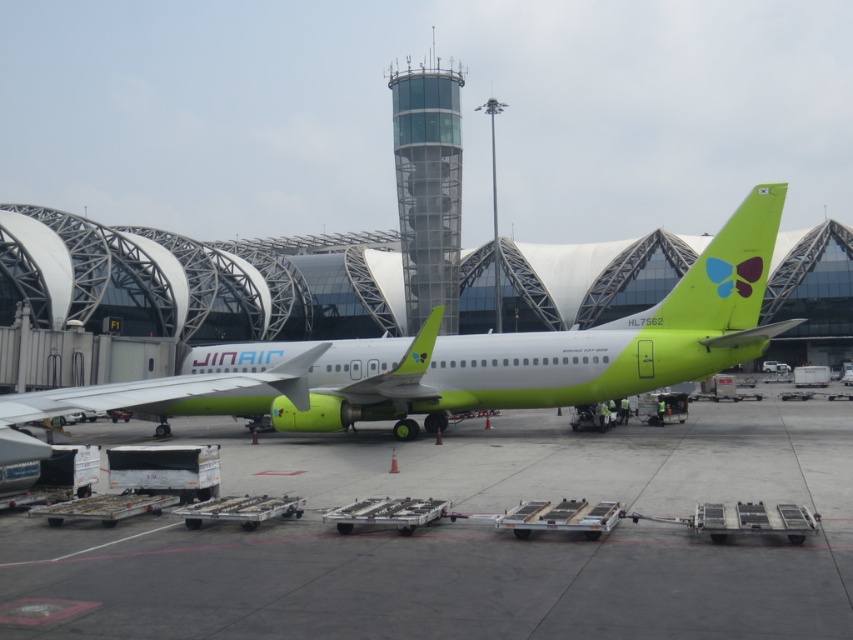
Question: In this image, where is green matte tarmac at center located relative to matte green airplane at center?

Choices:
 (A) below
 (B) above

Answer: (A)

Question: Can you confirm if green matte tarmac at center is bigger than matte green airplane at center?

Choices:
 (A) yes
 (B) no

Answer: (B)

Question: Where is green matte tarmac at center located in relation to matte green airplane at center in the image?

Choices:
 (A) above
 (B) below

Answer: (B)

Question: Among these points, which one is farthest from the camera?

Choices:
 (A) (434, 349)
 (B) (426, 576)

Answer: (A)